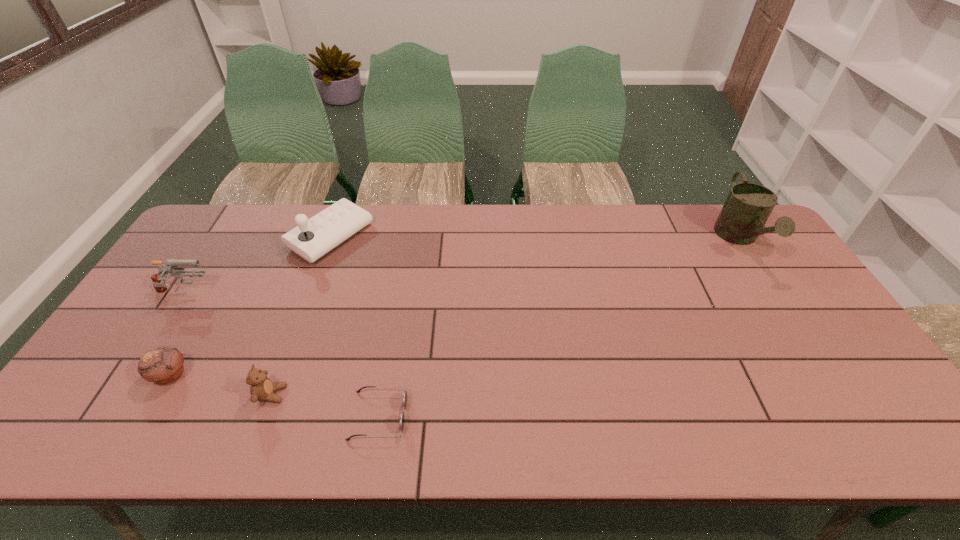
Image resolution: width=960 pixels, height=540 pixels. What are the coordinates of `the rightmost object` in the screenshot? It's located at (748, 206).

Image resolution: width=960 pixels, height=540 pixels. I want to click on the tallest object, so click(748, 206).

Locate an element on the screen. This screenshot has width=960, height=540. joystick is located at coordinates (312, 238).

The height and width of the screenshot is (540, 960). Find the location of `the fourth nearest object`. the fourth nearest object is located at coordinates (158, 280).

What are the coordinates of `the fourth shortest object` in the screenshot? It's located at (158, 280).

Locate an element on the screen. The height and width of the screenshot is (540, 960). teddy bear is located at coordinates (262, 388).

The width and height of the screenshot is (960, 540). What are the coordinates of `muffin` in the screenshot? It's located at point(163,365).

The image size is (960, 540). Find the location of `the shortest object`. the shortest object is located at coordinates (402, 416).

Locate an element on the screen. sunglasses is located at coordinates (402, 416).

At what (x,y) coordinates should I click in order to perform the action: click on free space located with the spout on the watering can. Please return your answer as a coordinate pair (x, y). The image size is (960, 540). Looking at the image, I should click on (781, 304).